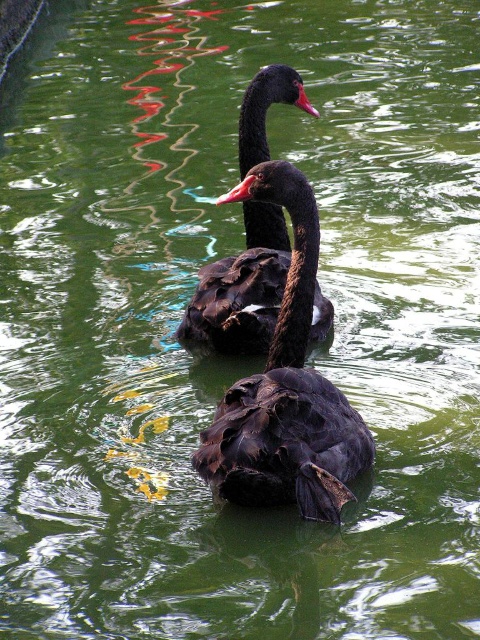
Question: Is shiny black swan at center thinner than matte black swan at upper center?

Choices:
 (A) no
 (B) yes

Answer: (B)

Question: Observing the image, what is the correct spatial positioning of shiny black swan at center in reference to matte black swan at upper center?

Choices:
 (A) below
 (B) above

Answer: (A)

Question: Does shiny black swan at center have a larger size compared to matte black swan at upper center?

Choices:
 (A) no
 (B) yes

Answer: (A)

Question: Which object is closer to the camera taking this photo?

Choices:
 (A) shiny black swan at center
 (B) matte black swan at upper center

Answer: (A)

Question: Among these objects, which one is farthest from the camera?

Choices:
 (A) matte black swan at upper center
 (B) shiny black swan at center

Answer: (A)

Question: Which point appears farthest from the camera in this image?

Choices:
 (A) (290, 88)
 (B) (254, 195)

Answer: (A)